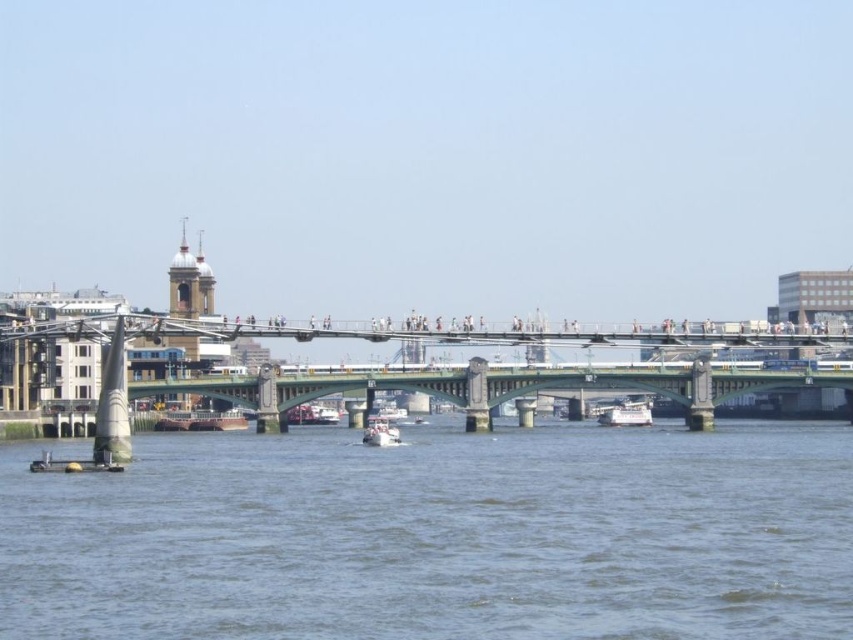
You are standing on the Millennium Bridge and want to take a photo of the white glossy boat at center. Which direction should you face to capture the boat in your shot?

The white glossy boat at center is located at point (625, 413), so you should face towards the lower center direction to capture it in your photo.

You are standing at the Millennium Bridge and want to know how far the point at coordinates (152, 529) is from you. Can you determine the distance?

The point at coordinates (152, 529) is 107.37 meters away from you.